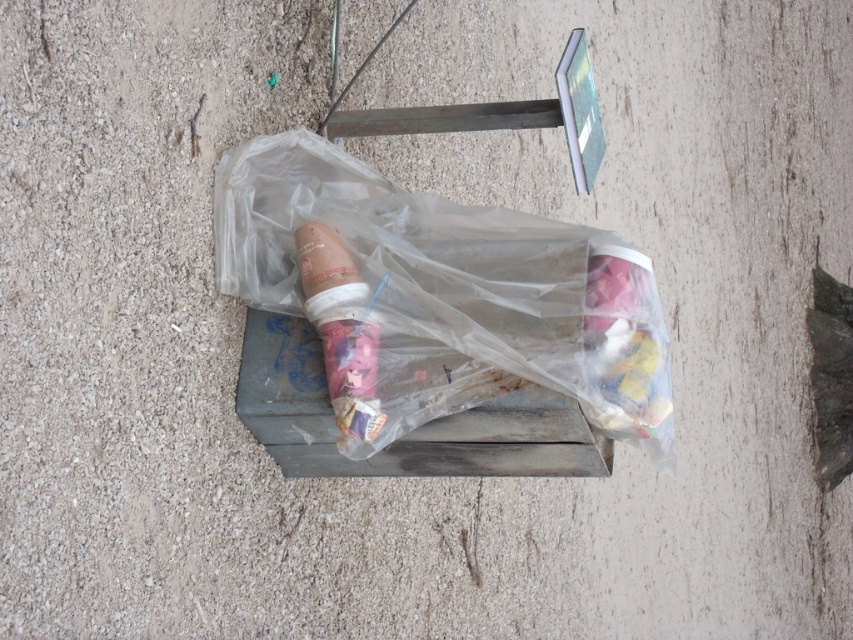
You are a waste disposal robot tasked with sorting items in the trash bin. You see the transparent plastic bag at center and the matte plastic ice cream cone at center. Which item has a greater width?

The transparent plastic bag at center has a greater width than the matte plastic ice cream cone at center.

You are standing next to the trash bin and see the transparent plastic bag at center and the matte plastic ice cream cone at center. Which item is located to the right of the other?

The transparent plastic bag at center is positioned on the right side of matte plastic ice cream cone at center.